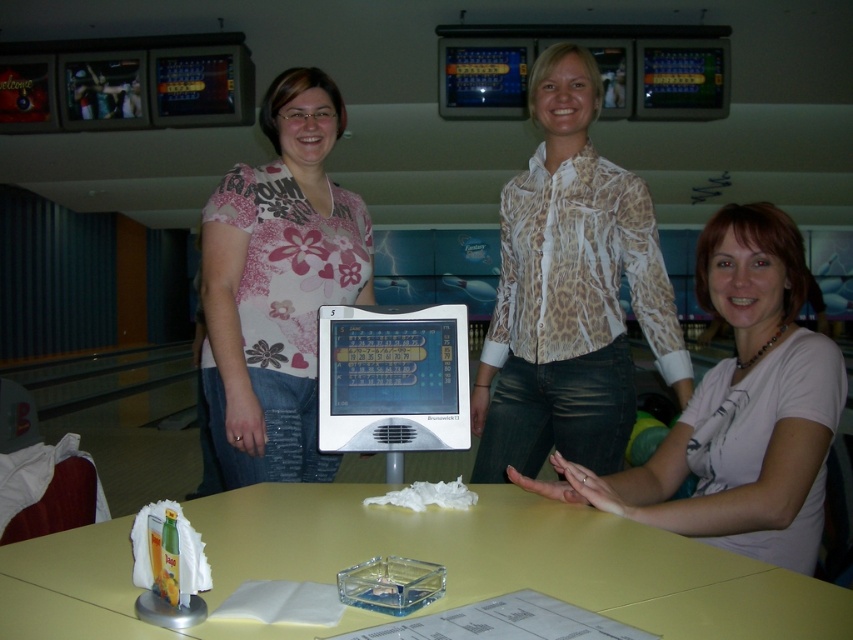
You are trying to decide where to place a large decorative bowl. The bowl is bigger than the yellow matte table at center. Can you place it on the leopard print blouse at center?

The leopard print blouse at center is larger than the yellow matte table at center. Since the bowl is bigger than the table, it might not fit on the blouse either unless the blouse is significantly larger than the table. However, based on the given information, we only know the blouse is larger than the table, but not by how much. Therefore, it is uncertain if the bowl will fit on the leopard print blouse at center.

Based on the photo, based on the scene description, where is the white matte shirt at center located in terms of coordinates?

The white matte shirt at center is located at coordinates point [740,410].

You are a photographer trying to capture a closeup of the leopard print blouse at center and the white matte shirt at center. Which one should you zoom in on more to ensure both are clearly visible in the frame?

The leopard print blouse at center is bigger than the white matte shirt at center, so you should zoom in more on the leopard print blouse at center to ensure both are clearly visible in the frame.